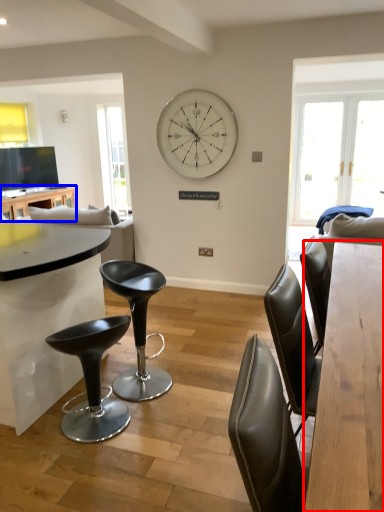
Question: Which point is further to the camera, table (highlighted by a red box) or table (highlighted by a blue box)?

Choices:
 (A) table
 (B) table

Answer: (B)